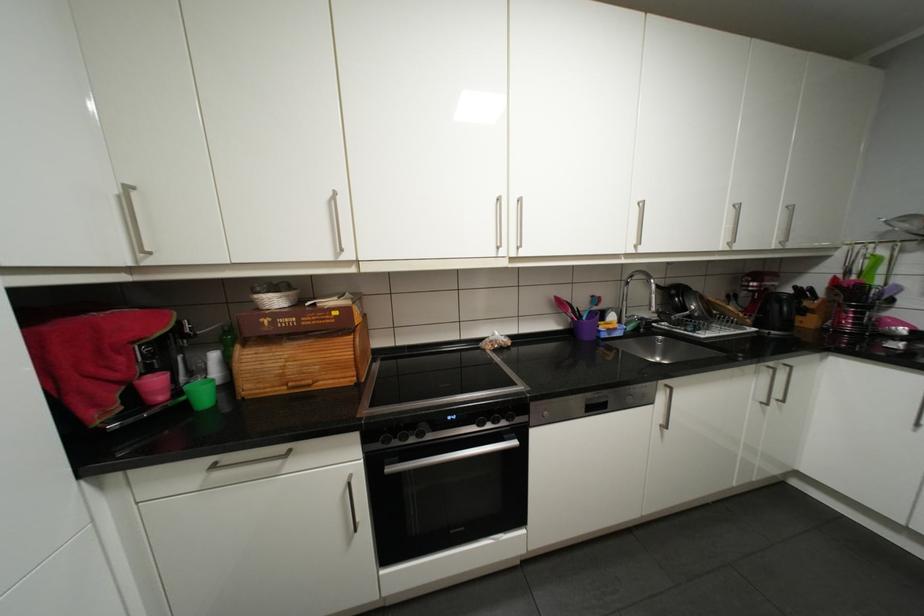
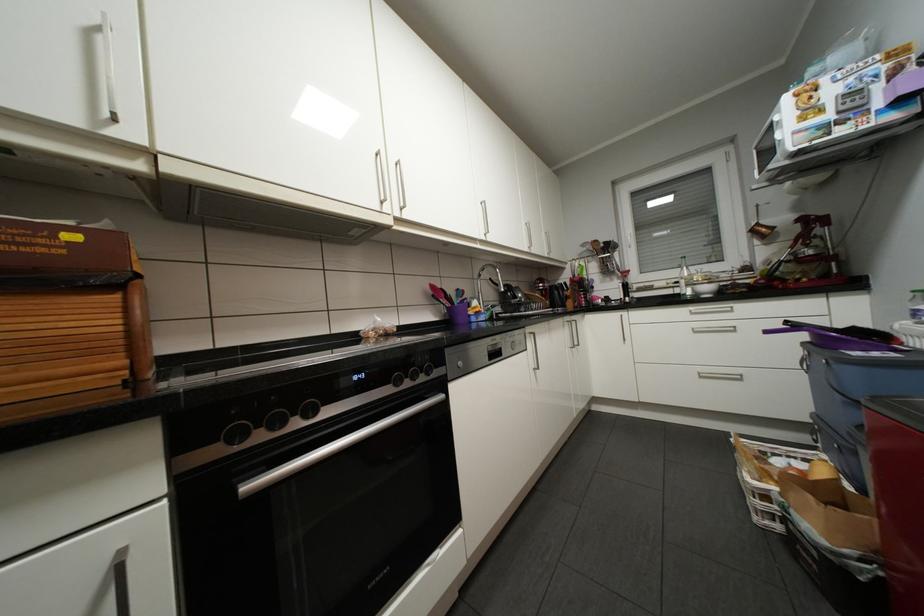
Question: Based on the continuous images, in which direction is the camera rotating? Reply with the corresponding letter.

Choices:
 (A) Left
 (B) Right
 (C) Up
 (D) Down

Answer: (B)